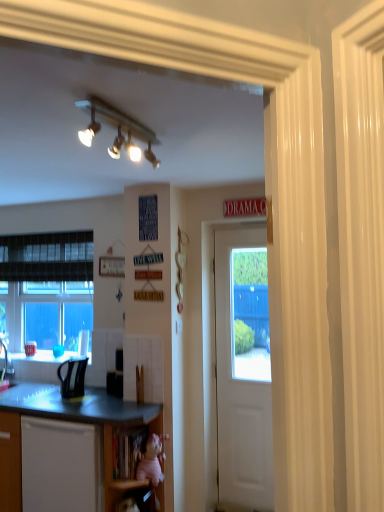
Locate an element on the screen. Image resolution: width=384 pixels, height=512 pixels. unoccupied region to the right of matte black kettle at left is located at coordinates (102, 395).